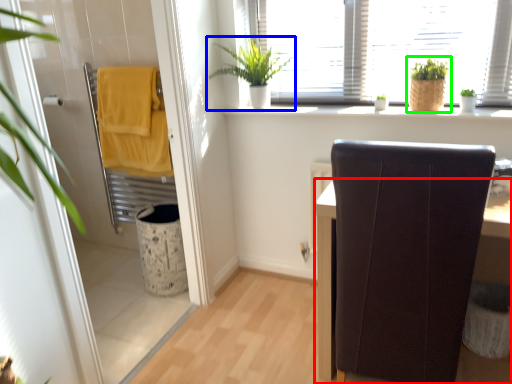
Question: Which object is the closest to the furniture (highlighted by a red box)? Choose among these: houseplant (highlighted by a blue box) or houseplant (highlighted by a green box).

Choices:
 (A) houseplant
 (B) houseplant

Answer: (B)